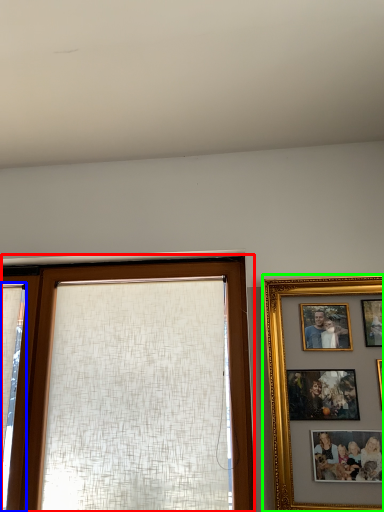
Question: Which object is positioned farthest from window (highlighted by a red box)? Select from curtain (highlighted by a blue box) and picture frame (highlighted by a green box).

Choices:
 (A) curtain
 (B) picture frame

Answer: (B)